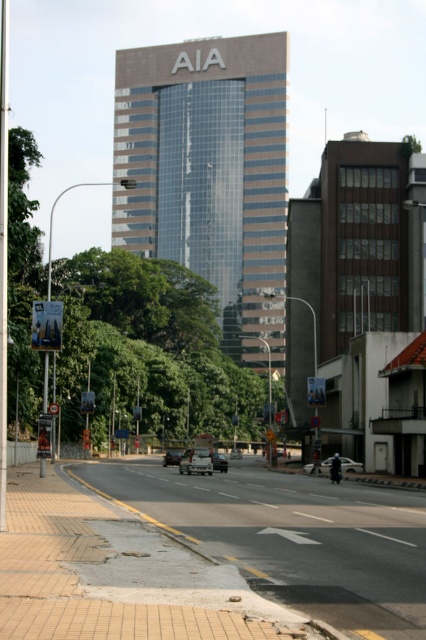
Does matte black car at center appear over dark gray metallic car at center?

Indeed, matte black car at center is positioned over dark gray metallic car at center.

Who is positioned more to the left, matte black car at center or dark gray metallic car at center?

Positioned to the left is dark gray metallic car at center.

Is point (319, 467) more distant than point (218, 458)?

No, it is not.

Where is `matte black car at center`? Image resolution: width=426 pixels, height=640 pixels. matte black car at center is located at coordinates pyautogui.click(x=350, y=465).

Does point (195, 451) come farther from viewer compared to point (54, 403)?

No, it is not.

This screenshot has height=640, width=426. Describe the element at coordinates (196, 460) in the screenshot. I see `metallic silver car at center` at that location.

Is point (190, 452) closer to viewer compared to point (48, 404)?

Yes.

The width and height of the screenshot is (426, 640). I want to click on metallic silver car at center, so click(x=196, y=460).

Is dark gray metallic car at center below matte silver van at center?

No.

Between point (216, 456) and point (241, 452), which one is positioned behind?

The point (241, 452) is behind.

The width and height of the screenshot is (426, 640). Find the location of `dark gray metallic car at center`. dark gray metallic car at center is located at coordinates (219, 461).